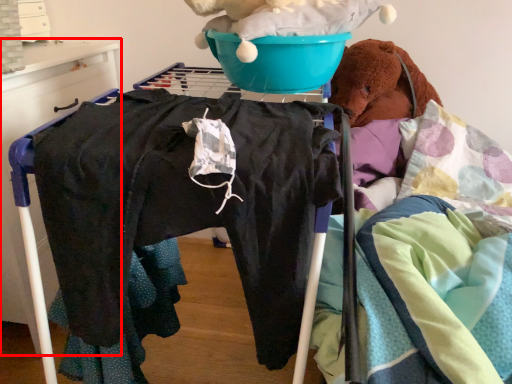
Question: From the image's perspective, what is the correct spatial relationship of furniture (annotated by the red box) in relation to basin?

Choices:
 (A) below
 (B) above

Answer: (A)